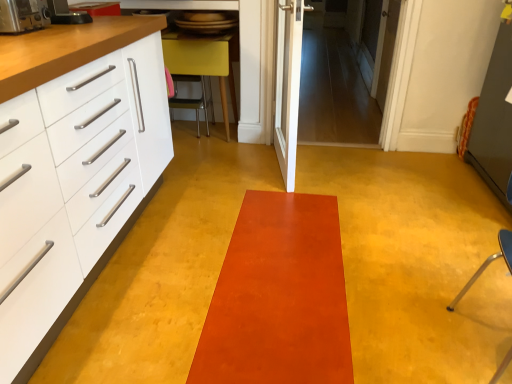
Locate an element on the screen. free point in front of white glossy door at center, acting as the second door starting from the right is located at coordinates (276, 206).